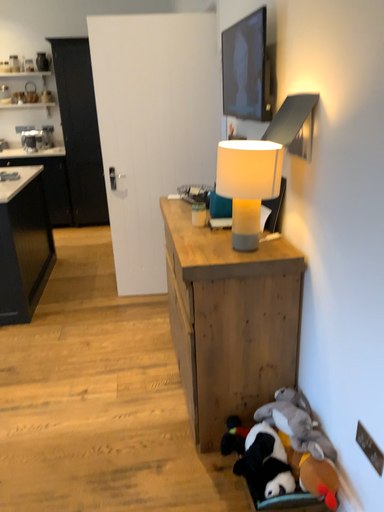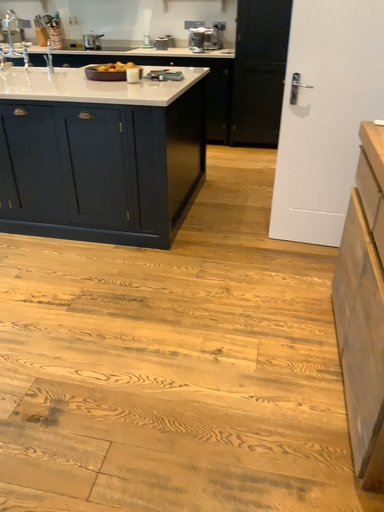
Question: How did the camera likely rotate when shooting the video?

Choices:
 (A) rotated left
 (B) rotated right

Answer: (A)